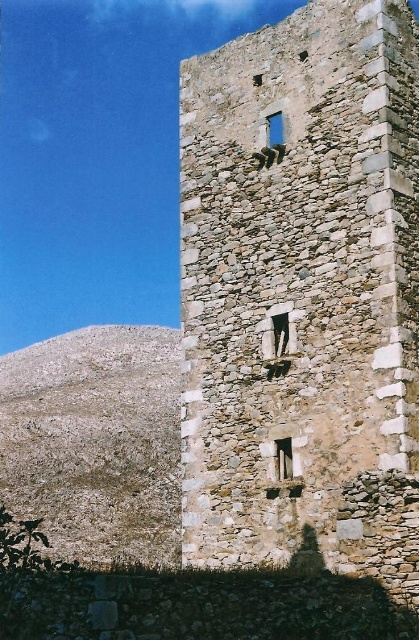
Question: Is brown rocky hill at lower left positioned at the back of smooth stone window at center?

Choices:
 (A) no
 (B) yes

Answer: (B)

Question: Among these objects, which one is nearest to the camera?

Choices:
 (A) smooth stone window at center
 (B) blue glass window at center
 (C) brown rocky hill at lower left
 (D) rustic stone tower at center

Answer: (D)

Question: Does rustic stone tower at center appear under brown rocky hill at lower left?

Choices:
 (A) yes
 (B) no

Answer: (B)

Question: Which point is closer to the camera?

Choices:
 (A) (x=279, y=346)
 (B) (x=101, y=516)
 (C) (x=186, y=451)
 (D) (x=276, y=131)

Answer: (A)

Question: Estimate the real-world distances between objects in this image. Which object is farther from the blue glass window at center?

Choices:
 (A) smooth stone window at center
 (B) rustic stone tower at center
 (C) brown rocky hill at lower left

Answer: (C)

Question: Is rustic stone tower at center positioned in front of smooth stone window at center?

Choices:
 (A) yes
 (B) no

Answer: (A)